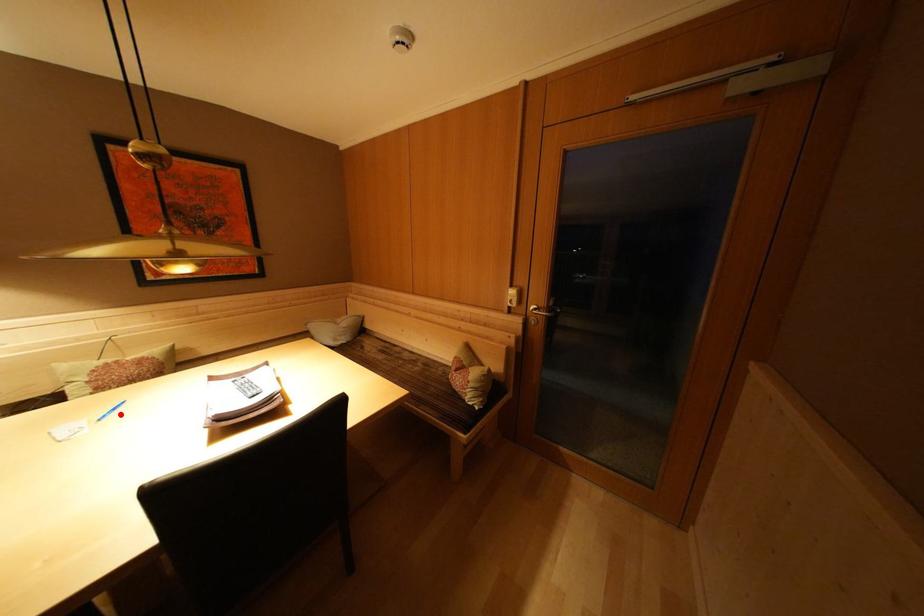
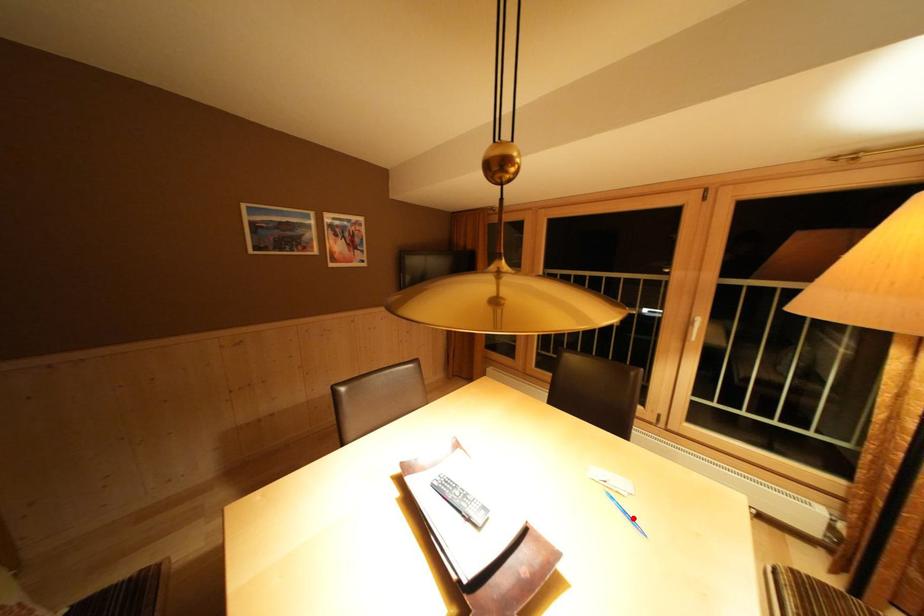
I am providing you with two images of the same scene from different viewpoints. A red point is marked on the first image and another point is marked on the second image. Do the highlighted points in image1 and image2 indicate the same real-world spot?

Yes